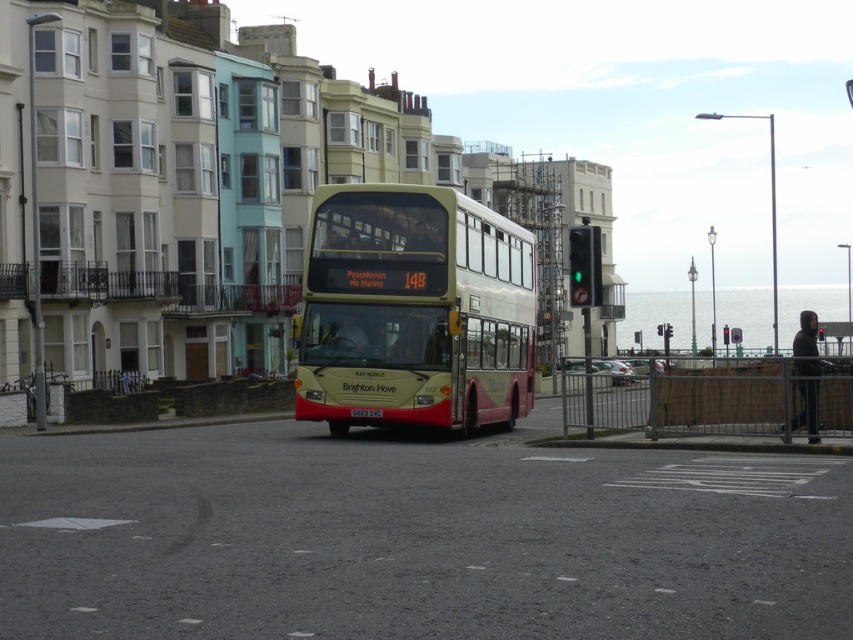
Question: From the image, what is the correct spatial relationship of beige glossy decker bus at center in relation to green glass traffic light at center?

Choices:
 (A) below
 (B) above

Answer: (A)

Question: Does beige glossy decker bus at center appear under green glass traffic light at center?

Choices:
 (A) yes
 (B) no

Answer: (A)

Question: Can you confirm if beige glossy decker bus at center is thinner than green glass traffic light at center?

Choices:
 (A) yes
 (B) no

Answer: (A)

Question: Which object is closer to the camera taking this photo?

Choices:
 (A) beige glossy decker bus at center
 (B) green glass traffic light at center

Answer: (B)

Question: Which object is farther from the camera taking this photo?

Choices:
 (A) green glass traffic light at center
 (B) beige glossy decker bus at center

Answer: (B)